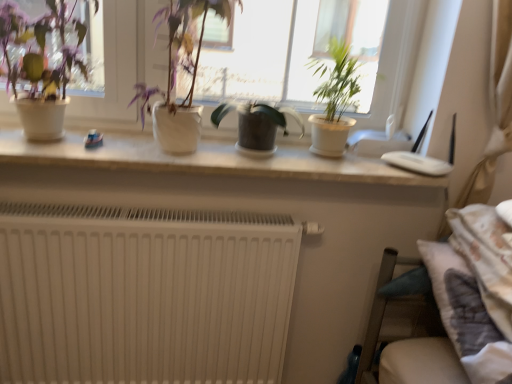
Question: Does matte white pot at upper left, marked as the 4th houseplant in a right-to-left arrangement, touch green matte plant at upper right, positioned as the first houseplant in right-to-left order?

Choices:
 (A) yes
 (B) no

Answer: (B)

Question: From the image's perspective, is matte white pot at upper left, the 1th houseplant from the left, above green matte plant at upper right, positioned as the fourth houseplant in left-to-right order?

Choices:
 (A) no
 (B) yes

Answer: (B)

Question: Is matte white pot at upper left, the 1th houseplant from the left, not within green matte plant at upper right, positioned as the first houseplant in right-to-left order?

Choices:
 (A) yes
 (B) no

Answer: (A)

Question: Is matte white pot at upper left, marked as the 4th houseplant in a right-to-left arrangement, taller than green matte plant at upper right, positioned as the first houseplant in right-to-left order?

Choices:
 (A) yes
 (B) no

Answer: (A)

Question: Would you consider matte white pot at upper left, marked as the 4th houseplant in a right-to-left arrangement, to be distant from green matte plant at upper right, positioned as the first houseplant in right-to-left order?

Choices:
 (A) yes
 (B) no

Answer: (B)

Question: In the image, is green matte plant at upper right, positioned as the fourth houseplant in left-to-right order, on the left side or the right side of matte white pot at upper left, marked as the 4th houseplant in a right-to-left arrangement?

Choices:
 (A) right
 (B) left

Answer: (A)

Question: Considering the positions of point (309, 119) and point (6, 21), is point (309, 119) closer or farther from the camera than point (6, 21)?

Choices:
 (A) farther
 (B) closer

Answer: (A)

Question: Would you say green matte plant at upper right, positioned as the first houseplant in right-to-left order, is inside or outside matte white pot at upper left, the 1th houseplant from the left?

Choices:
 (A) outside
 (B) inside

Answer: (A)

Question: In the image, is green matte plant at upper right, positioned as the fourth houseplant in left-to-right order, positioned in front of or behind matte white pot at upper left, the 1th houseplant from the left?

Choices:
 (A) front
 (B) behind

Answer: (B)

Question: From the image's perspective, is matte white pot at center, which is counted as the 2th houseplant, starting from the left, located above or below green matte plant at center, which is counted as the second houseplant, starting from the right?

Choices:
 (A) below
 (B) above

Answer: (B)

Question: Considering the positions of matte white pot at center, which is the third houseplant from right to left, and green matte plant at center, the 3th houseplant viewed from the left, in the image, is matte white pot at center, which is the third houseplant from right to left, bigger or smaller than green matte plant at center, the 3th houseplant viewed from the left,?

Choices:
 (A) small
 (B) big

Answer: (B)

Question: From a real-world perspective, is matte white pot at center, which is the third houseplant from right to left, above or below green matte plant at center, the 3th houseplant viewed from the left?

Choices:
 (A) below
 (B) above

Answer: (B)

Question: Is matte white pot at center, which is counted as the 2th houseplant, starting from the left, wider or thinner than green matte plant at center, which is counted as the second houseplant, starting from the right?

Choices:
 (A) thin
 (B) wide

Answer: (B)

Question: Looking at the image, does green matte plant at upper right, positioned as the fourth houseplant in left-to-right order, seem bigger or smaller compared to white matte radiator at lower left?

Choices:
 (A) big
 (B) small

Answer: (B)

Question: Is green matte plant at upper right, positioned as the first houseplant in right-to-left order, in front of or behind white matte radiator at lower left in the image?

Choices:
 (A) front
 (B) behind

Answer: (A)